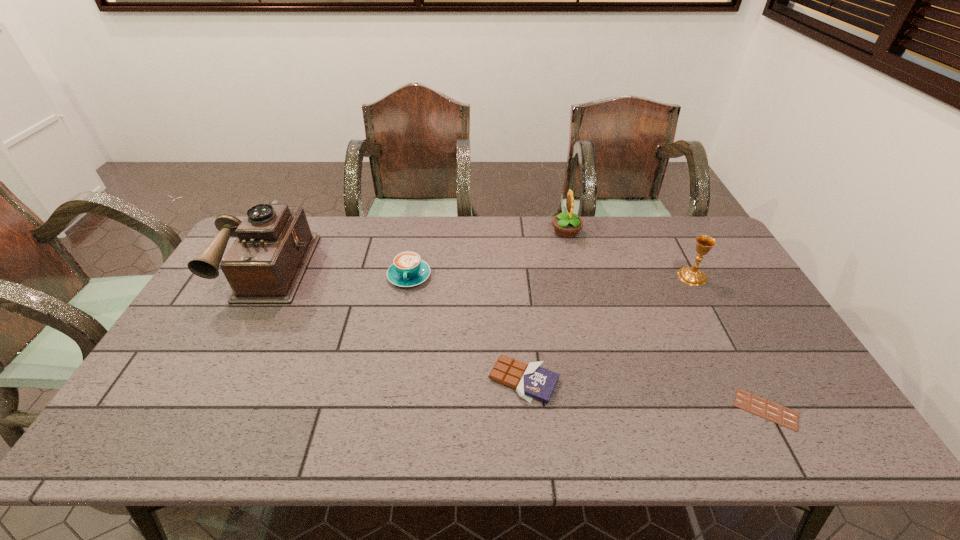
Image resolution: width=960 pixels, height=540 pixels. I want to click on free location located 0.220m on the horn of the tallest object, so click(214, 365).

Find the location of `vacant space located 0.230m on the face of the third object from right to left`. vacant space located 0.230m on the face of the third object from right to left is located at coordinates (487, 232).

What are the coordinates of `free region located on the face of the third object from right to left` in the screenshot? It's located at (512, 232).

Identify the location of vacant region located on the face of the third object from right to left. The image size is (960, 540). (465, 232).

Find the location of a particular element. The image size is (960, 540). vacant region located 0.250m on the front of the chalice is located at coordinates click(732, 350).

Where is `vacant position located with the handle on the right side of the fifth object from right to left`? This screenshot has height=540, width=960. vacant position located with the handle on the right side of the fifth object from right to left is located at coordinates (402, 315).

The image size is (960, 540). What are the coordinates of `free point located 0.360m on the right of the second shortest object` in the screenshot? It's located at (703, 380).

Locate an element on the screen. free point located 0.210m on the back of the right chocolate bar is located at coordinates (721, 325).

This screenshot has width=960, height=540. Find the location of `phonograph_record that is at the far edge`. phonograph_record that is at the far edge is located at coordinates (266, 263).

Image resolution: width=960 pixels, height=540 pixels. I want to click on sunflower present at the far edge, so click(x=566, y=225).